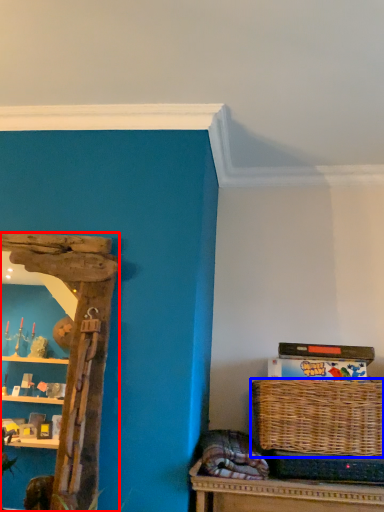
Question: Which point is closer to the camera, shelf (highlighted by a red box) or picnic basket (highlighted by a blue box)?

Choices:
 (A) shelf
 (B) picnic basket

Answer: (A)